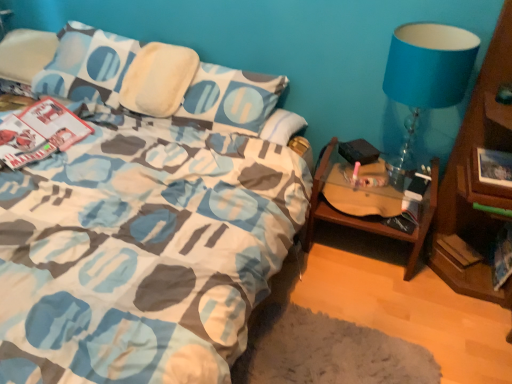
Question: From their relative heights in the image, would you say woodenobject at right is taller or shorter than hardcover book at lower right?

Choices:
 (A) tall
 (B) short

Answer: (A)

Question: Is woodenobject at right in front of or behind hardcover book at lower right in the image?

Choices:
 (A) front
 (B) behind

Answer: (A)

Question: Which of these objects is positioned closest to the hardcover book at lower right?

Choices:
 (A) blue fabric lampshade at upper right
 (B) woodenobject at right

Answer: (B)

Question: Considering the real-world distances, which object is farthest from the woodenobject at right?

Choices:
 (A) hardcover book at lower right
 (B) blue fabric lampshade at upper right

Answer: (B)